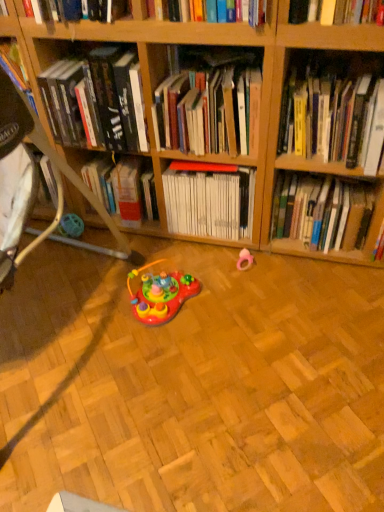
At what (x,y) coordinates should I click in order to perform the action: click on unoccupied space behind shiny plastic toy at center, which is the first toy in left-to-right order. Please return your answer as a coordinate pair (x, y). Image resolution: width=384 pixels, height=512 pixels. Looking at the image, I should click on (167, 257).